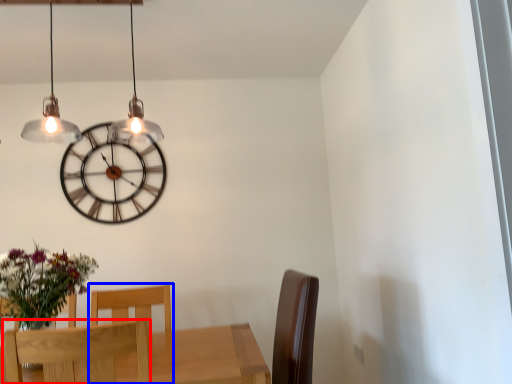
Question: Among these objects, which one is farthest to the camera, chair (highlighted by a red box) or chair (highlighted by a blue box)?

Choices:
 (A) chair
 (B) chair

Answer: (B)